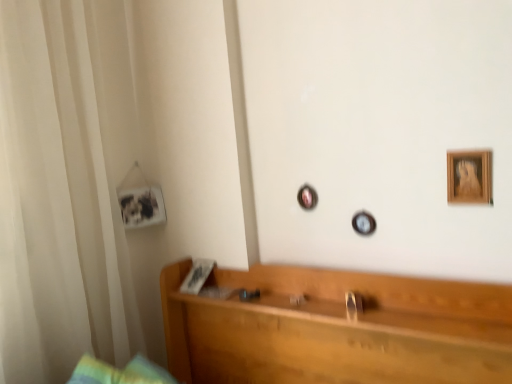
Question: Is the position of white sheer curtain at left more distant than that of wooden headboard at center?

Choices:
 (A) no
 (B) yes

Answer: (B)

Question: Can you confirm if white sheer curtain at left is bigger than wooden headboard at center?

Choices:
 (A) no
 (B) yes

Answer: (B)

Question: From a real-world perspective, is white sheer curtain at left under wooden headboard at center?

Choices:
 (A) no
 (B) yes

Answer: (A)

Question: From the image's perspective, is white sheer curtain at left on top of wooden headboard at center?

Choices:
 (A) yes
 (B) no

Answer: (A)

Question: Is white sheer curtain at left outside of wooden headboard at center?

Choices:
 (A) yes
 (B) no

Answer: (A)

Question: Considering the relative sizes of white sheer curtain at left and wooden headboard at center in the image provided, is white sheer curtain at left wider than wooden headboard at center?

Choices:
 (A) no
 (B) yes

Answer: (B)

Question: Is there a large distance between wooden headboard at center and wooden picture frame at upper right, the first picture frame viewed from the front?

Choices:
 (A) yes
 (B) no

Answer: (B)

Question: Is wooden headboard at center touching wooden picture frame at upper right, placed as the 2th picture frame when sorted from left to right?

Choices:
 (A) yes
 (B) no

Answer: (B)

Question: Does wooden headboard at center have a lesser width compared to wooden picture frame at upper right, positioned as the 1th picture frame in right-to-left order?

Choices:
 (A) yes
 (B) no

Answer: (B)

Question: Is wooden headboard at center facing away from wooden picture frame at upper right, the first picture frame viewed from the front?

Choices:
 (A) yes
 (B) no

Answer: (B)

Question: Is wooden headboard at center aimed at wooden picture frame at upper right, placed as the 2th picture frame when sorted from left to right?

Choices:
 (A) yes
 (B) no

Answer: (B)

Question: Does wooden headboard at center have a greater width compared to wooden picture frame at upper right, positioned as the 1th picture frame in right-to-left order?

Choices:
 (A) yes
 (B) no

Answer: (A)

Question: Does wooden picture frame at upper right, the first picture frame viewed from the front, contain wooden headboard at center?

Choices:
 (A) yes
 (B) no

Answer: (B)